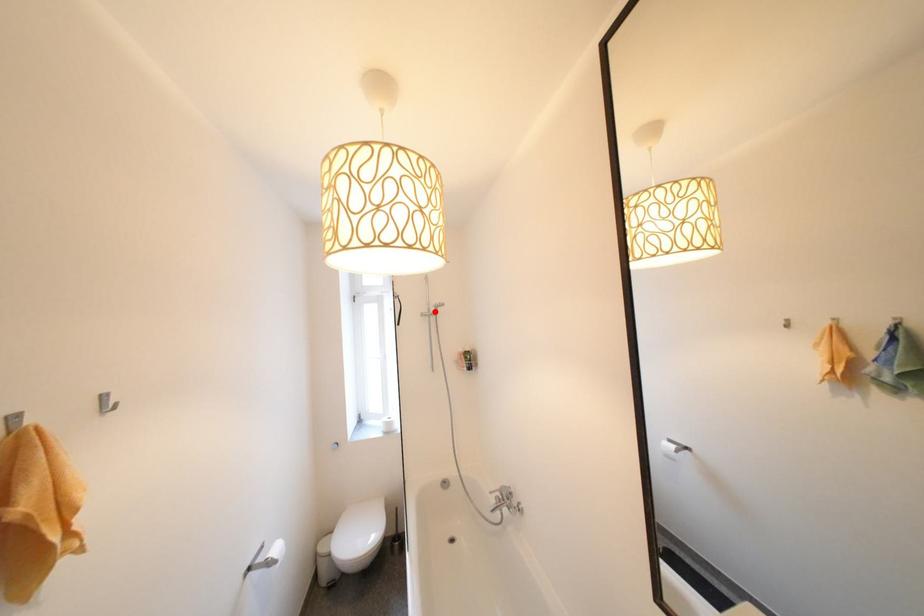
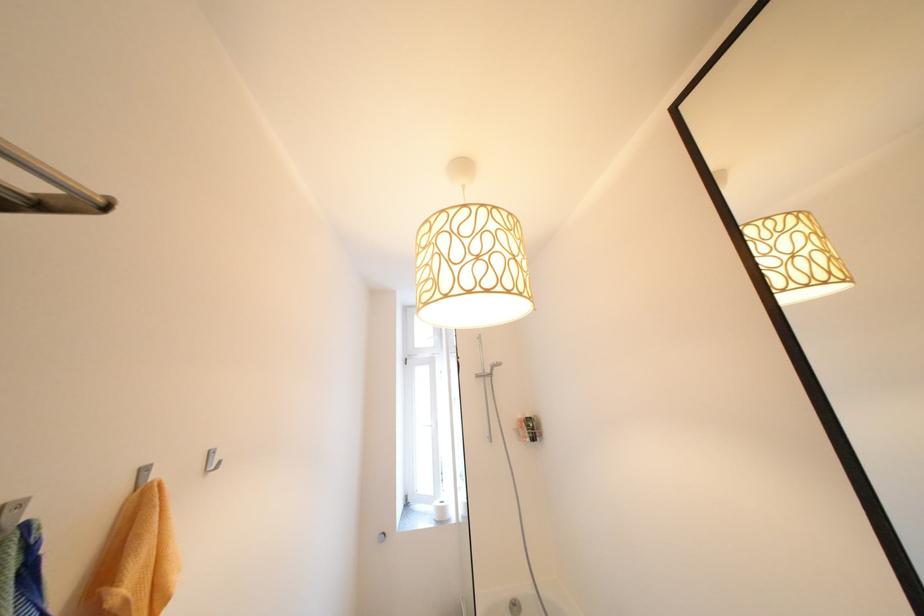
Locate, in the second image, the point that corresponds to the highlighted location in the first image.

(490, 371)